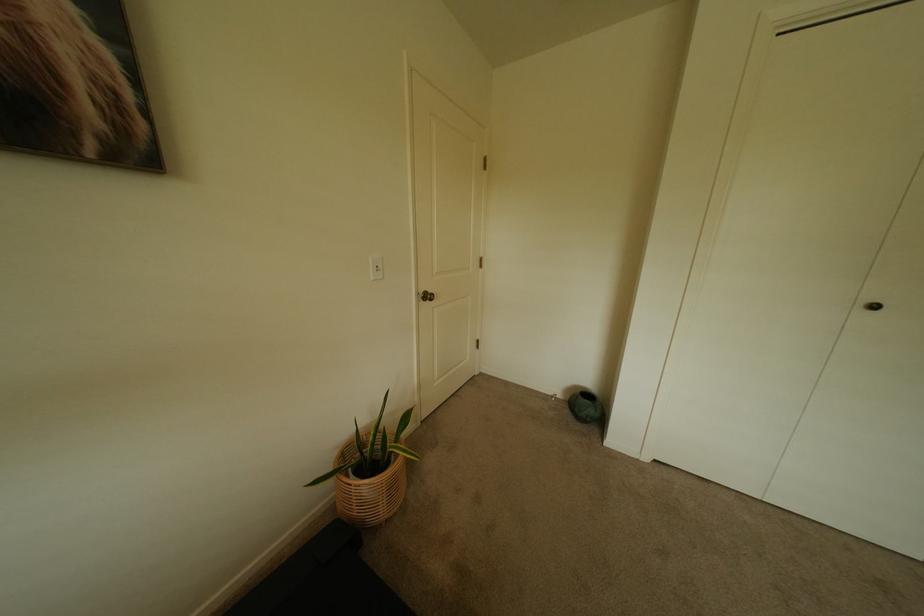
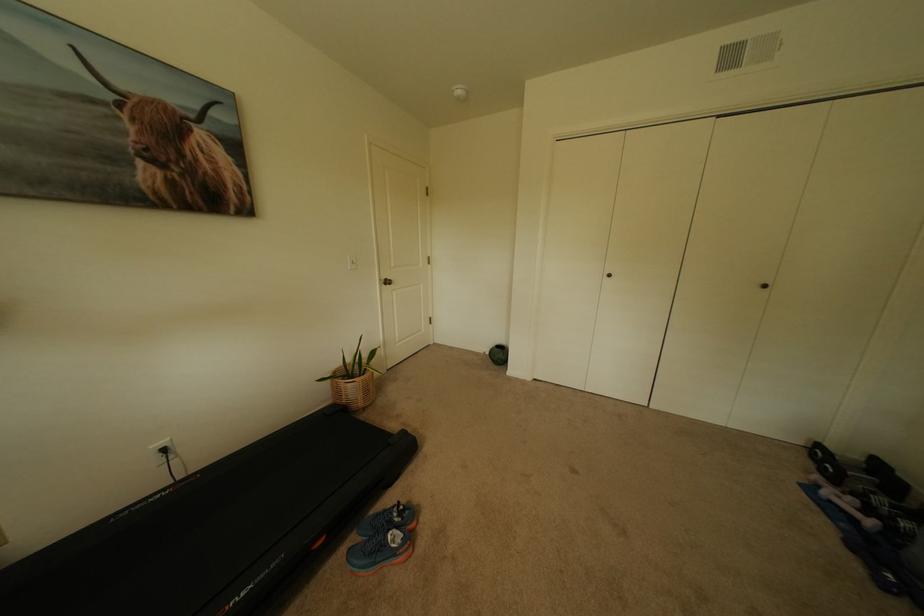
In the second image, find the point that corresponds to (430,293) in the first image.

(391, 280)